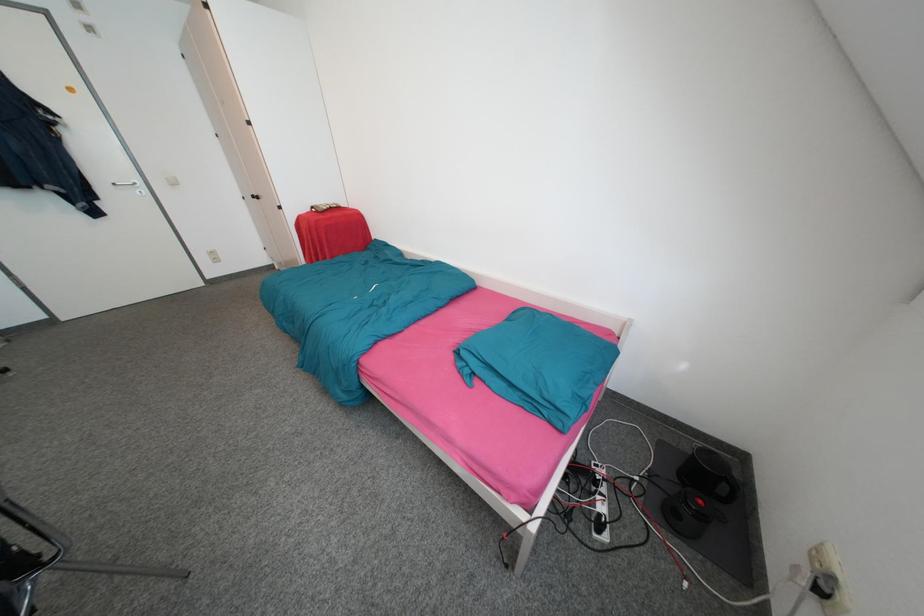
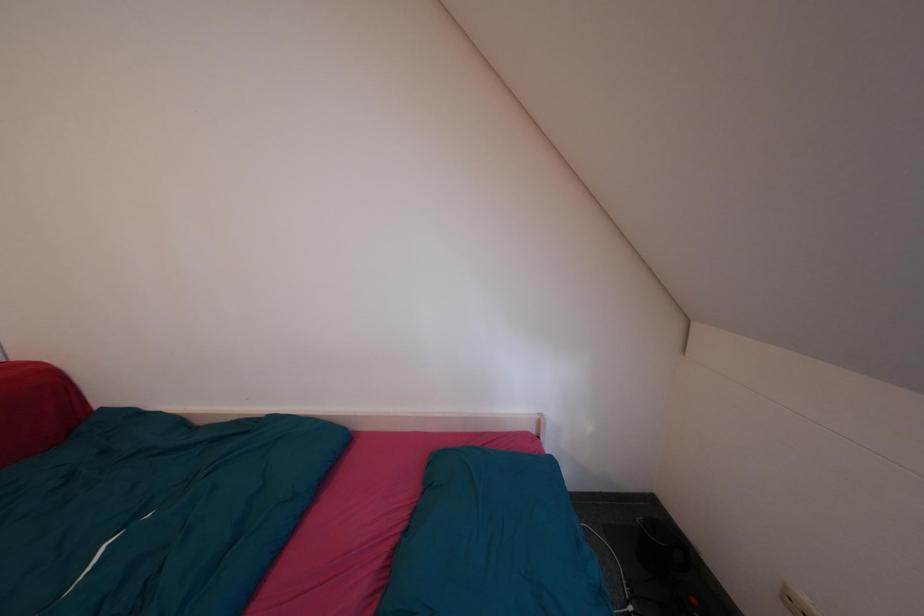
Question: The first image is from the beginning of the video and the second image is from the end. How did the camera likely rotate when shooting the video?

Choices:
 (A) Left
 (B) Right
 (C) Up
 (D) Down

Answer: (B)